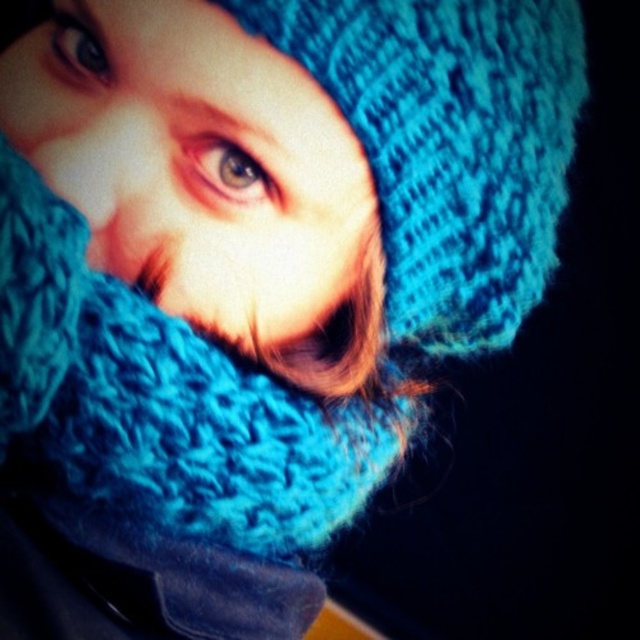
You are designing a winter accessory catalog and need to know if the blue knitted hat at upper center can fit over the matte blue eye at upper left without covering it. Based on their sizes, can the hat be positioned so that the eye remains visible?

The blue knitted hat at upper center has a larger width than the matte blue eye at upper left. Therefore, the hat can be positioned in a way that allows the eye to remain visible without being fully covered.

You are a photographer adjusting the focus on your camera. You notice two points in the image at coordinates point (237, 150) and point (74, 56). Which point should you focus on to ensure it appears sharp in the final photo?

Point (237, 150) is closer to the camera than point (74, 56), so focusing on point (237, 150) will ensure it appears sharp in the final photo.

In the scene shown: You are a photographer adjusting the lighting for a closeup shot. You notice the blue knitted hat at upper center and the brown matte eye at upper center. Which object is located more to the left side of the image?

The blue knitted hat at upper center is positioned on the left side of the brown matte eye at upper center, so it is more to the left.